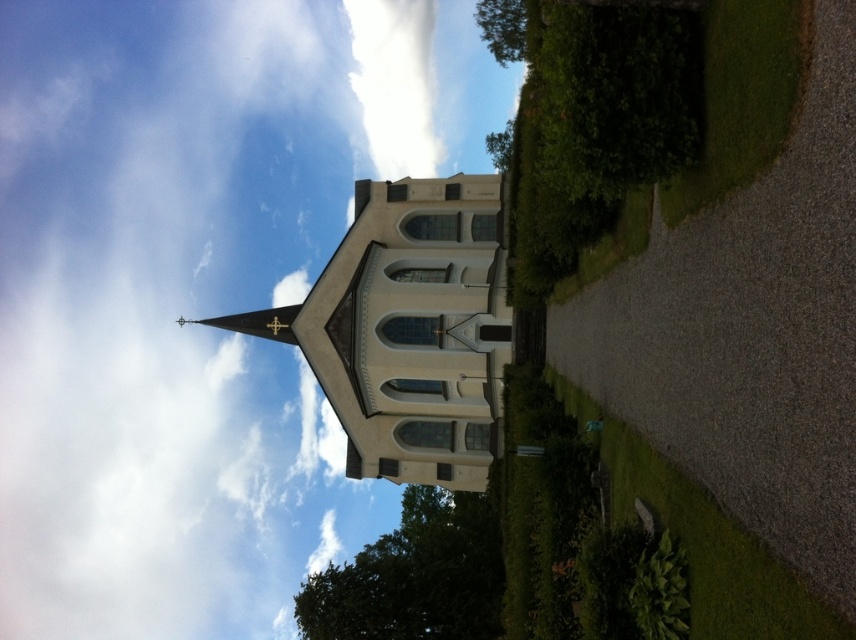
Is point (64, 412) closer to camera compared to point (388, 410)?

No, (64, 412) is behind (388, 410).

Can you confirm if white fluffy cloud at upper left is positioned to the left of white smooth church steeple at center?

Indeed, white fluffy cloud at upper left is positioned on the left side of white smooth church steeple at center.

Find the location of a particular element. The width and height of the screenshot is (856, 640). white fluffy cloud at upper left is located at coordinates (195, 291).

The width and height of the screenshot is (856, 640). I want to click on white fluffy cloud at upper left, so click(x=195, y=291).

Does white smooth church steeple at center lie in front of green leafy tree at upper center?

Yes.

Which is more to the right, white smooth church steeple at center or green leafy tree at upper center?

green leafy tree at upper center

Between point (467, 243) and point (515, 35), which one is positioned in front?

Point (467, 243) is in front.

The height and width of the screenshot is (640, 856). In order to click on white smooth church steeple at center in this screenshot , I will do `click(408, 330)`.

Where is `white fluffy cloud at upper left`? white fluffy cloud at upper left is located at coordinates (195, 291).

Does white fluffy cloud at upper left have a greater height compared to green leafy tree at lower center?

Indeed, white fluffy cloud at upper left has a greater height compared to green leafy tree at lower center.

Does point (141, 349) come behind point (333, 618)?

Yes, it is behind point (333, 618).

In order to click on white fluffy cloud at upper left in this screenshot , I will do `click(195, 291)`.